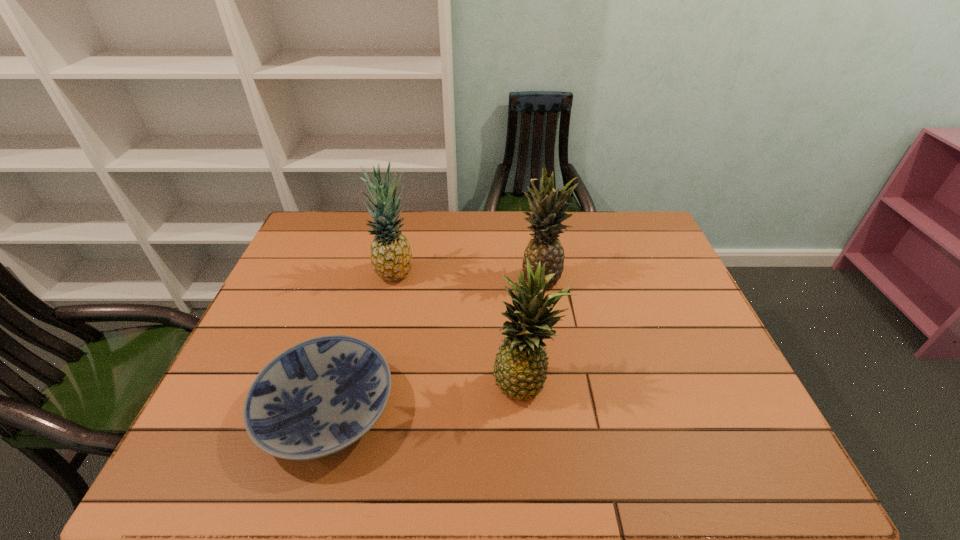
This screenshot has height=540, width=960. Identify the location of vacant space that satisfies the following two spatial constraints: 1. on the back side of the leftmost pineapple; 2. on the right side of the shortest object. (368, 273).